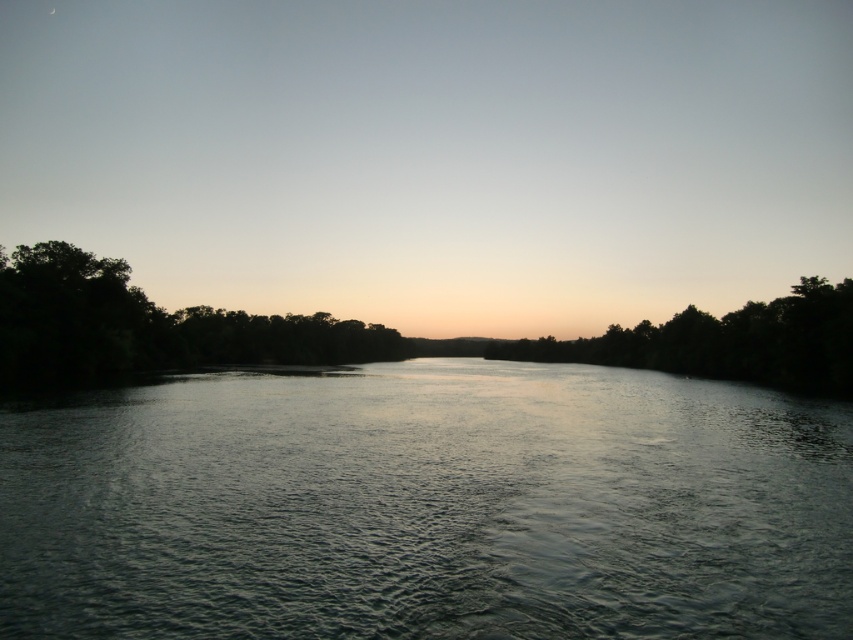
You are standing at the edge of the river and want to cross to the other side. The dark gray water at center flows towards the right. Which direction should you walk relative to the dark green leafy trees at left to avoid the current?

You should walk towards the right of the dark green leafy trees at left to avoid the current since the dark gray water at center flows towards the right, which is in the direction of the trees.

You are standing at the riverbank and see two points in the distance. The first point is at coordinate point (410, 497) and the second is at point (817, 378). Which point is closer to you?

Point (410, 497) is in front of point (817, 378), so the first point is closer to you.